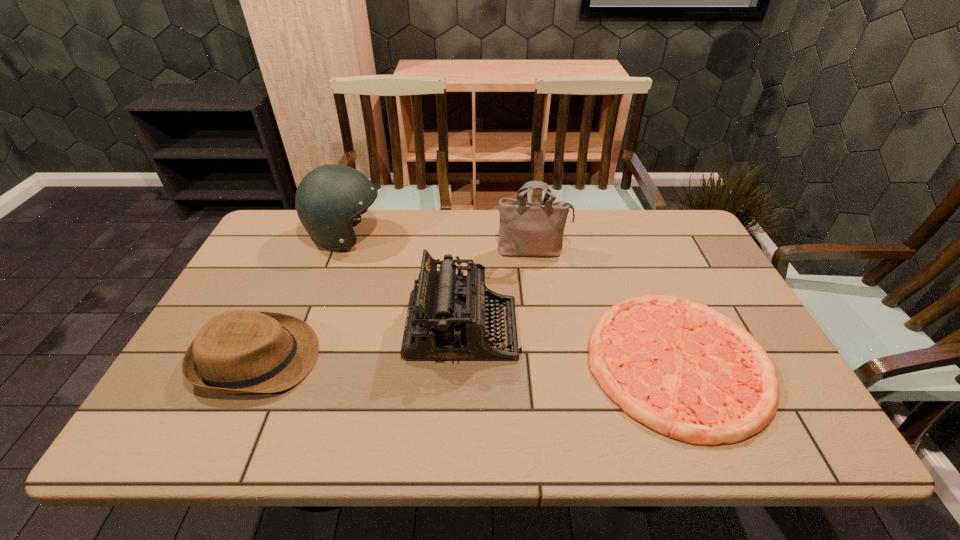
Find the location of a particular element. The image size is (960, 540). free spot between the pizza and the typewriter is located at coordinates (570, 346).

Locate an element on the screen. The image size is (960, 540). the second closest object to the typewriter is located at coordinates (685, 370).

Choose which object is the second nearest neighbor to the shortest object. Please provide its 2D coordinates. Your answer should be formatted as a tuple, i.e. [(x, y)], where the tuple contains the x and y coordinates of a point satisfying the conditions above.

[(526, 228)]

At what (x,y) coordinates should I click in order to perform the action: click on vacant position in the image that satisfies the following two spatial constraints: 1. on the front-facing side of the pizza; 2. on the left side of the shoulder bag. Please return your answer as a coordinate pair (x, y). Looking at the image, I should click on (549, 362).

I want to click on free space that satisfies the following two spatial constraints: 1. on the front-facing side of the shoulder bag; 2. on the front-facing side of the fedora, so click(549, 359).

You are a GUI agent. You are given a task and a screenshot of the screen. Output one action in this format:
    pyautogui.click(x=<x>, y=<y>)
    Task: Click on the free location that satisfies the following two spatial constraints: 1. on the keyboard of the shortest object; 2. on the right side of the typewriter
    The width and height of the screenshot is (960, 540).
    Given the screenshot: What is the action you would take?
    pyautogui.click(x=462, y=362)

At what (x,y) coordinates should I click in order to perform the action: click on blank space that satisfies the following two spatial constraints: 1. on the back side of the shortest object; 2. at the face opening of the football helmet. Please return your answer as a coordinate pair (x, y). Looking at the image, I should click on (626, 235).